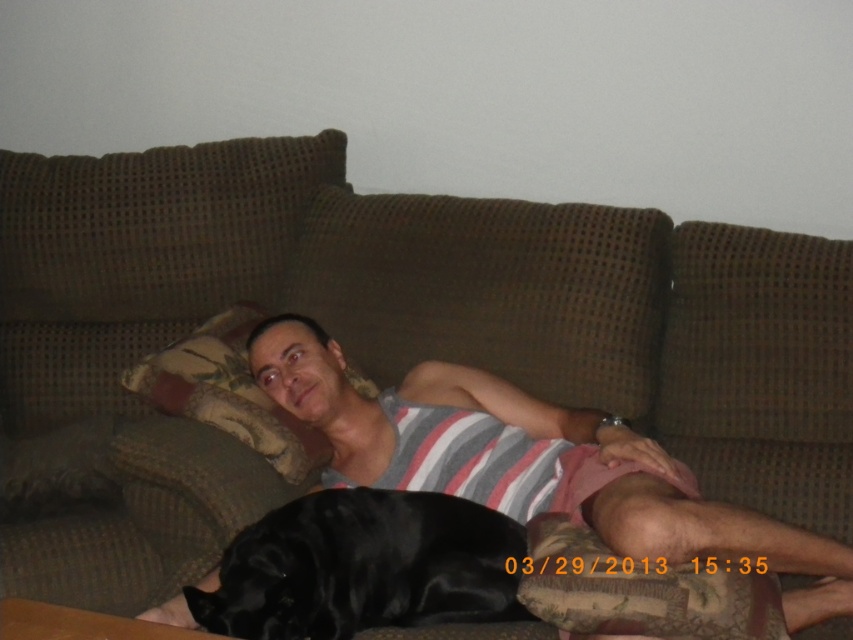
Is striped fabric tank top at center taller than shiny black dog at lower left?

Yes, striped fabric tank top at center is taller than shiny black dog at lower left.

Which is above, striped fabric tank top at center or shiny black dog at lower left?

Positioned higher is striped fabric tank top at center.

From the picture: Who is more distant from viewer, (517, 442) or (437, 541)?

Positioned behind is point (517, 442).

Image resolution: width=853 pixels, height=640 pixels. I want to click on striped fabric tank top at center, so click(x=531, y=461).

Is point (515, 464) farther from camera compared to point (207, 346)?

That is False.

Consider the image. Which of these two, striped fabric tank top at center or brown textured pillow at upper left, stands taller?

With more height is striped fabric tank top at center.

Who is more forward, (488, 403) or (219, 381)?

Positioned in front is point (488, 403).

At what (x,y) coordinates should I click in order to perform the action: click on striped fabric tank top at center. Please return your answer as a coordinate pair (x, y). Looking at the image, I should click on (531, 461).

Who is taller, shiny black dog at lower left or brown textured pillow at upper left?

brown textured pillow at upper left is taller.

Is shiny black dog at lower left to the right of brown textured pillow at upper left from the viewer's perspective?

Yes, shiny black dog at lower left is to the right of brown textured pillow at upper left.

Is point (448, 545) farther from camera compared to point (218, 420)?

That is False.

This screenshot has width=853, height=640. What are the coordinates of `shiny black dog at lower left` in the screenshot? It's located at (364, 566).